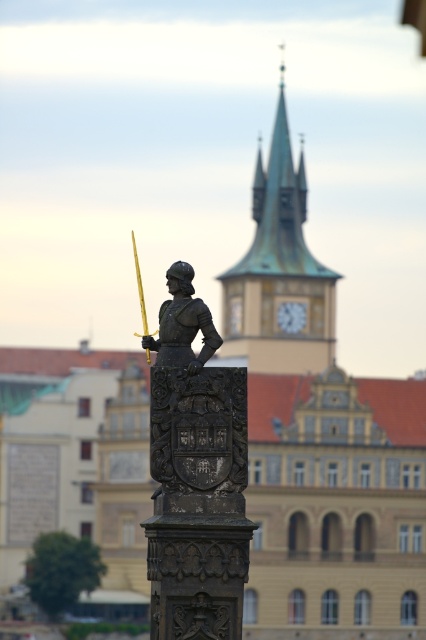
Is green copper tower at upper center below metallic clock face at center?

No, green copper tower at upper center is not below metallic clock face at center.

Is point (224, 284) closer to camera compared to point (296, 323)?

That is False.

Who is more forward, (x=276, y=252) or (x=288, y=323)?

Point (x=288, y=323) is in front.

Where is `green copper tower at upper center`? The width and height of the screenshot is (426, 640). green copper tower at upper center is located at coordinates (279, 269).

Does polished bronze statue at center have a smaller size compared to gold metallic sword at center?

Correct, polished bronze statue at center occupies less space than gold metallic sword at center.

Is polished bronze statue at center bigger than gold metallic sword at center?

Actually, polished bronze statue at center might be smaller than gold metallic sword at center.

Is point (175, 524) farther from camera compared to point (149, 358)?

No.

Image resolution: width=426 pixels, height=640 pixels. Identify the location of polished bronze statue at center. (195, 476).

This screenshot has height=640, width=426. What do you see at coordinates (291, 316) in the screenshot? I see `metallic clock face at center` at bounding box center [291, 316].

Between metallic clock face at center and gold metallic sword at center, which one has more height?

gold metallic sword at center

Describe the element at coordinates (291, 316) in the screenshot. I see `metallic clock face at center` at that location.

This screenshot has width=426, height=640. Identify the location of metallic clock face at center. (291, 316).